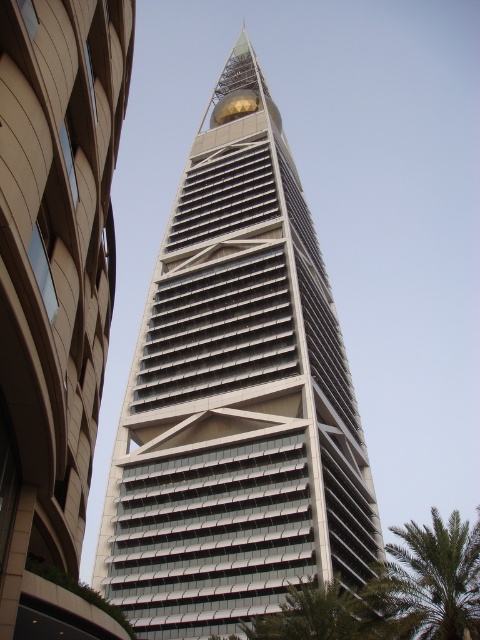
Who is shorter, white glass skyscraper at center or green leafy palm tree at lower right?

With less height is green leafy palm tree at lower right.

I want to click on white glass skyscraper at center, so click(236, 396).